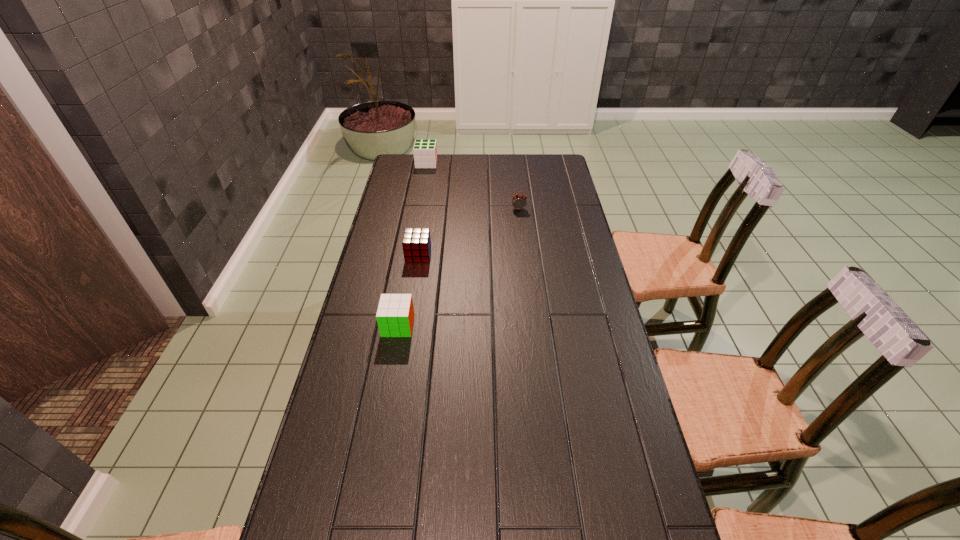
At what (x,y) coordinates should I click in order to perform the action: click on the farthest object. Please return your answer as a coordinate pair (x, y). Looking at the image, I should click on (425, 151).

Find the location of `the nearest object`. the nearest object is located at coordinates (395, 314).

The width and height of the screenshot is (960, 540). What are the coordinates of `the second nearest object` in the screenshot? It's located at point(416,243).

The image size is (960, 540). Identify the location of the rightmost object. (519, 201).

Image resolution: width=960 pixels, height=540 pixels. I want to click on the third nearest object, so click(519, 201).

The image size is (960, 540). Find the location of `free space located on the red face of the farthest cube`. free space located on the red face of the farthest cube is located at coordinates (467, 164).

You are a GUI agent. You are given a task and a screenshot of the screen. Output one action in this format:
    pyautogui.click(x=<x>, y=<y>)
    Task: Click on the blank space located 0.190m on the front of the nearest cube
    
    Given the screenshot: What is the action you would take?
    pyautogui.click(x=386, y=394)

Identify the location of free spot located on the right of the second nearest cube. (487, 254).

This screenshot has width=960, height=540. What are the coordinates of `vacant space located 0.120m on the face of the third nearest object` in the screenshot? It's located at (521, 229).

The width and height of the screenshot is (960, 540). I want to click on object positioned at the far edge, so click(x=425, y=151).